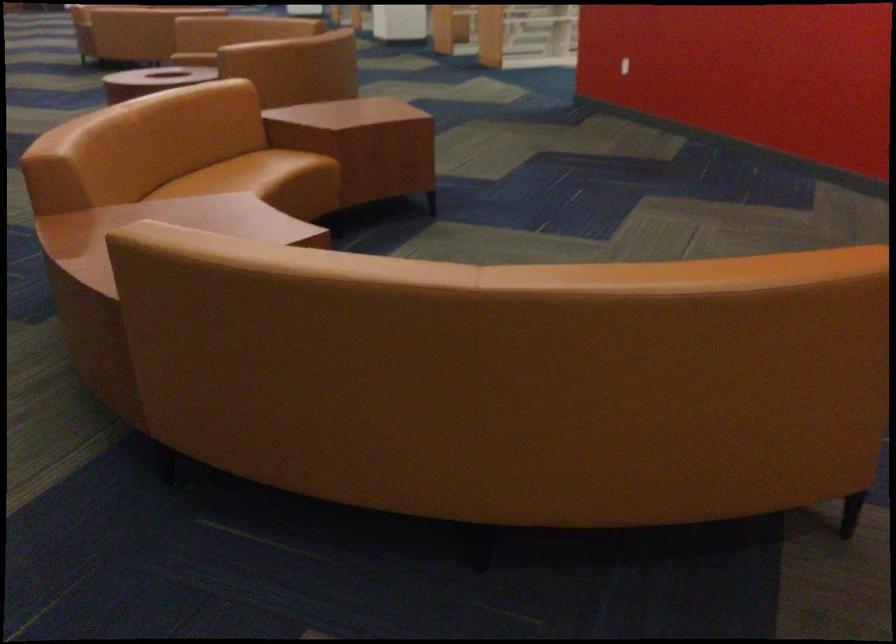
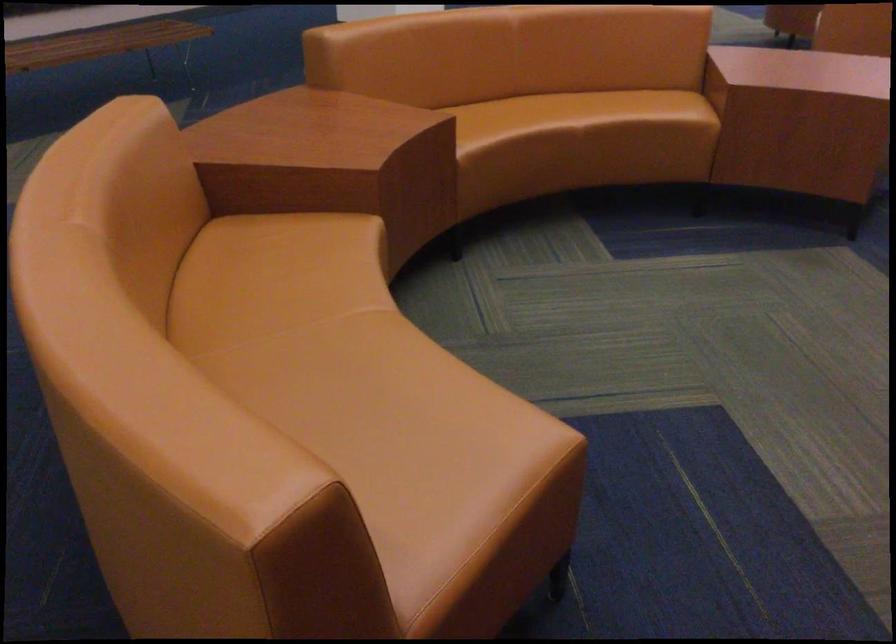
Where in the second image is the point corresponding to point 226,191 from the first image?

(538, 113)